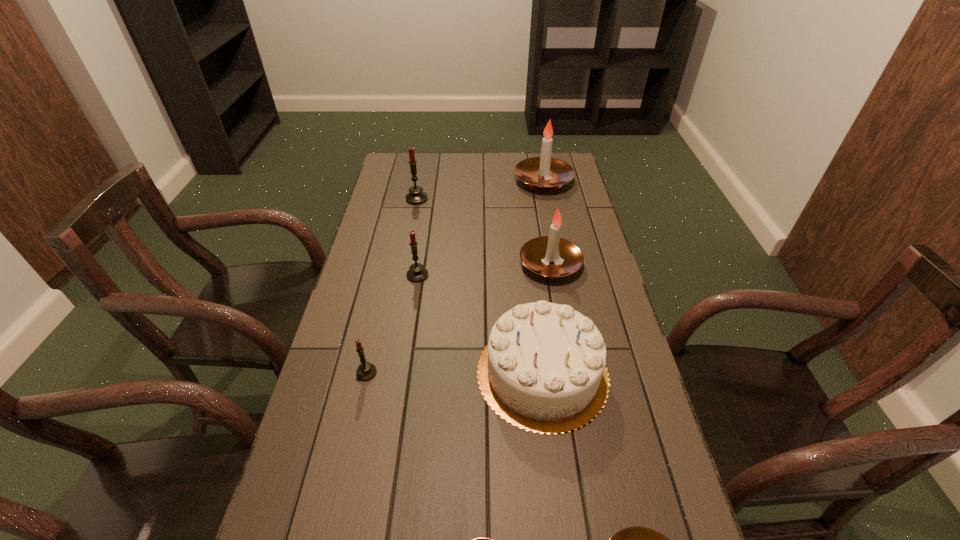
Identify which white candle is the third closest to the birthday cake. Please provide its 2D coordinates. Your answer should be formatted as a tuple, i.e. [(x, y)], where the tuple contains the x and y coordinates of a point satisfying the conditions above.

[(477, 539)]

Locate which red candle is the second closest to the birthday cake. Please provide its 2D coordinates. Your answer should be formatted as a tuple, i.e. [(x, y)], where the tuple contains the x and y coordinates of a point satisfying the conditions above.

[(366, 371)]

Identify the location of red candle that stands as the closest to the third nearest white candle. [417, 273].